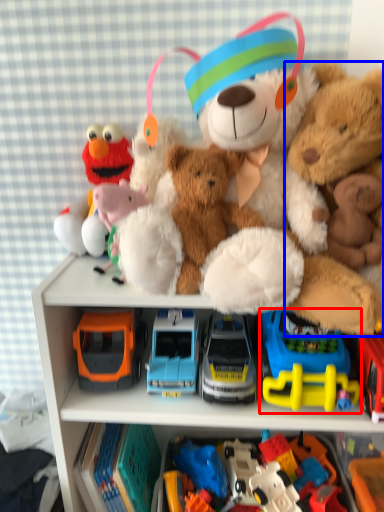
Question: Which point is further to the camera, toy (highlighted by a red box) or teddy bear (highlighted by a blue box)?

Choices:
 (A) toy
 (B) teddy bear

Answer: (A)